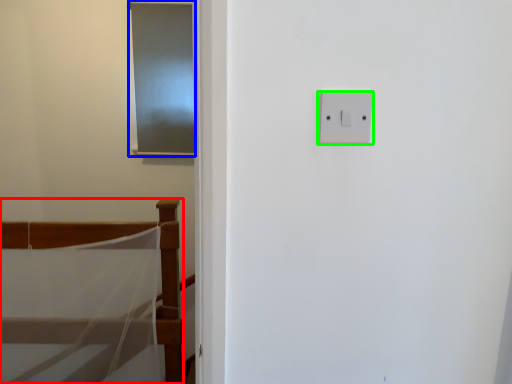
Question: Estimate the real-world distances between objects in this image. Which object is farther from furniture (highlighted by a red box), screen door (highlighted by a blue box) or light switch (highlighted by a green box)?

Choices:
 (A) screen door
 (B) light switch

Answer: (B)